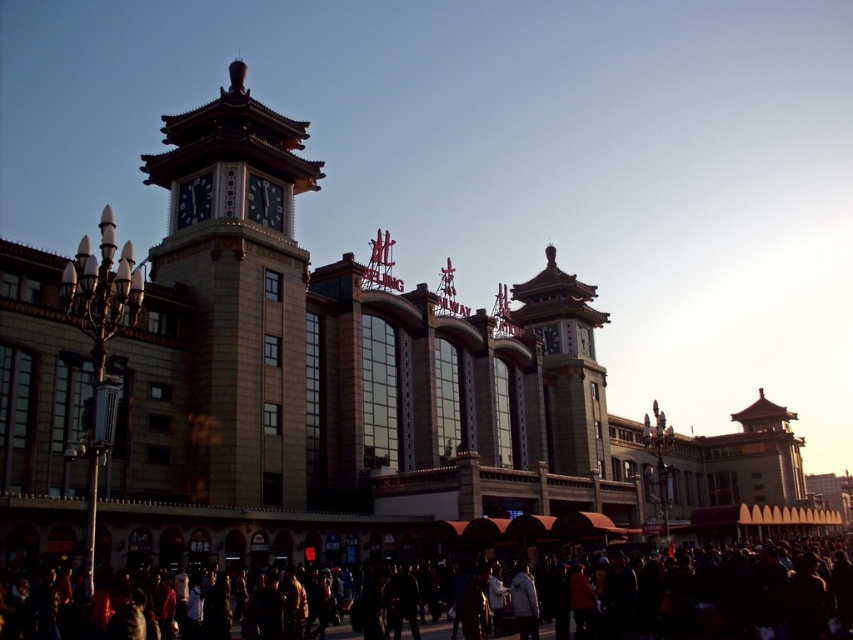
Question: Which point is farther to the camera?

Choices:
 (A) (708, 618)
 (B) (248, 189)
 (C) (187, 202)
 (D) (548, 264)

Answer: (D)

Question: Is beige stone clock tower at center-left to the right of dark clothing at lower center from the viewer's perspective?

Choices:
 (A) yes
 (B) no

Answer: (B)

Question: Can you confirm if dark clothing at lower center is positioned to the right of matte black clock at center?

Choices:
 (A) yes
 (B) no

Answer: (A)

Question: Can you confirm if golden stone tower at center is positioned to the left of matte black clock at center?

Choices:
 (A) no
 (B) yes

Answer: (A)

Question: Among these points, which one is nearest to the camera?

Choices:
 (A) (726, 577)
 (B) (572, 420)
 (C) (158, 244)

Answer: (A)

Question: Which point is farther to the camera?

Choices:
 (A) (204, 120)
 (B) (196, 188)
 (C) (218, 595)
 (D) (271, 221)

Answer: (D)